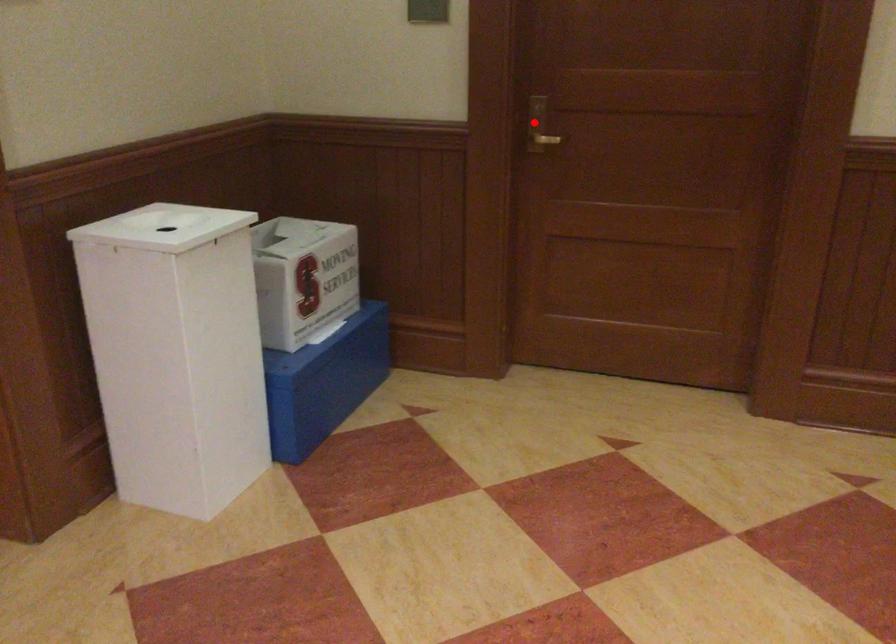
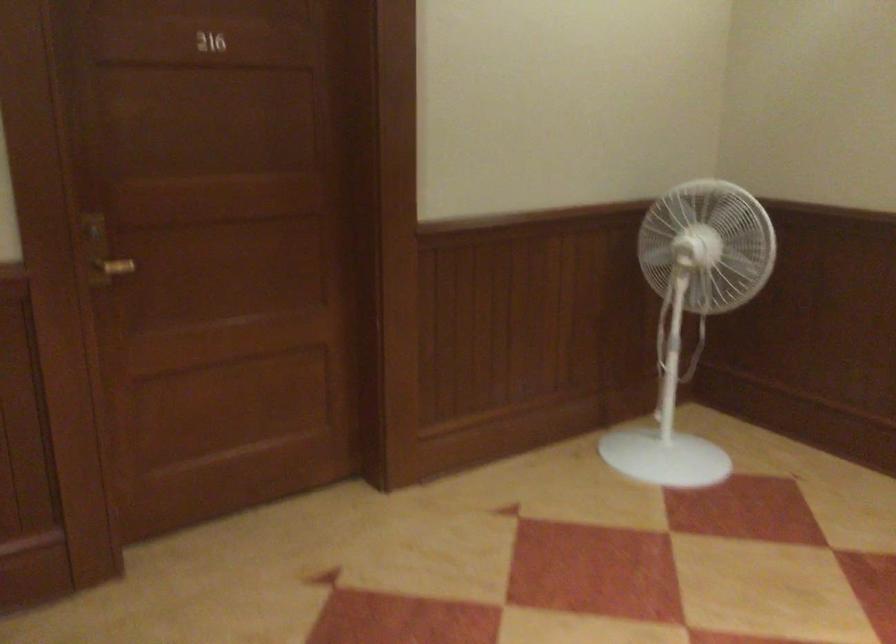
Question: I am providing you with two images of the same scene from different viewpoints. A red point is shown in image1. For the corresponding object point in image2, is it positioned nearer or farther from the camera?

Choices:
 (A) Nearer
 (B) Farther

Answer: (A)